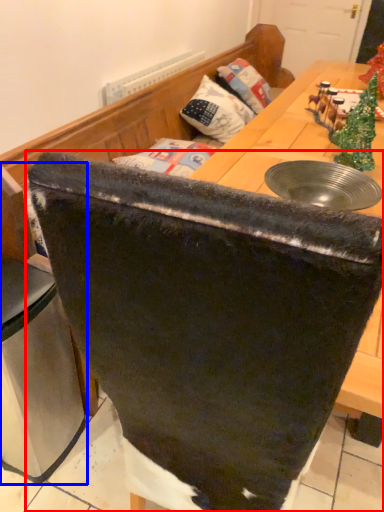
Question: Which object is further to the camera taking this photo, chair (highlighted by a red box) or leftover (highlighted by a blue box)?

Choices:
 (A) chair
 (B) leftover

Answer: (B)